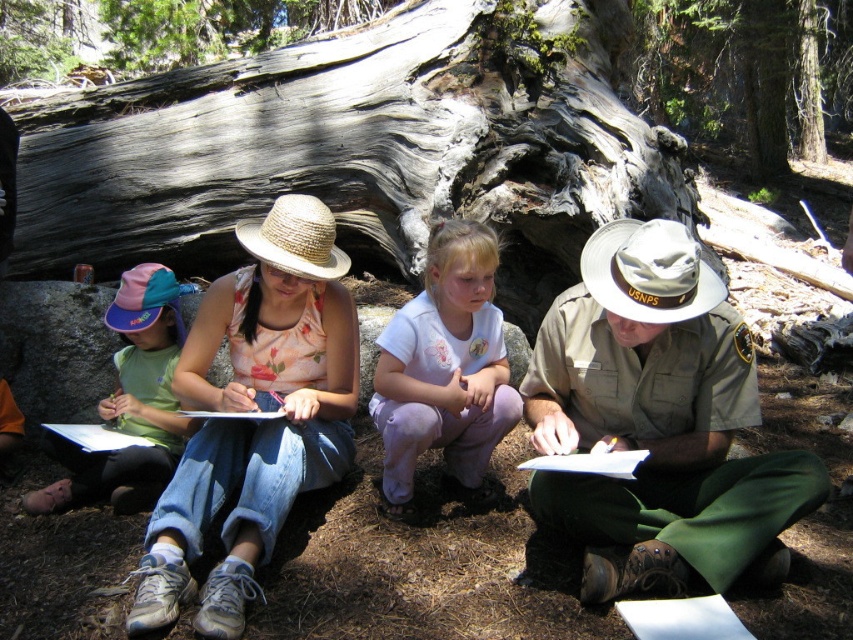
You are a photographer trying to capture a clear shot of the khaki uniform at center and the matte straw hat at center. Which object should you zoom in on to ensure it appears larger in your photo?

The matte straw hat at center is larger than the khaki uniform at center, so you should zoom in on the khaki uniform at center to make it appear larger in the photo.

You are a participant in the outdoor activity and want to take a photo of the gray rough bark tree trunk at upper center without any people in the frame. Is the khaki uniform at center blocking your view of the tree trunk?

The khaki uniform at center is closer to the viewer than the gray rough bark tree trunk at upper center, so it is blocking your view of the tree trunk. You would need to move around or ask the person to move to capture an unobstructed photo.